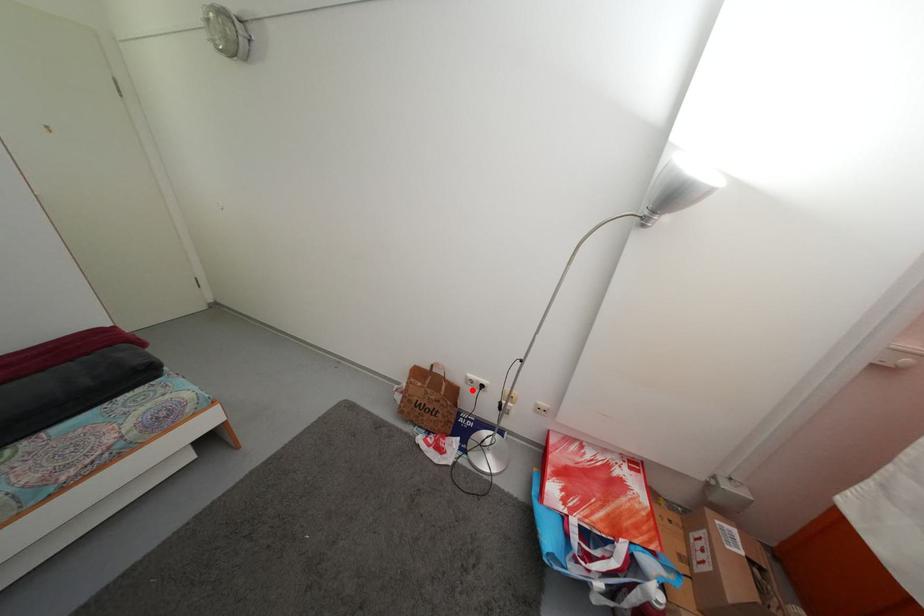
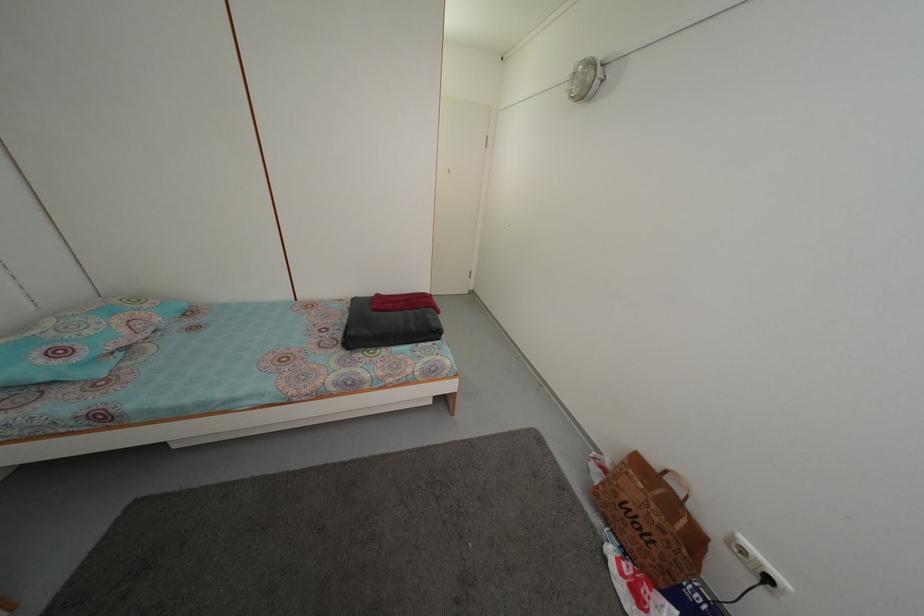
Where in the second image is the point corresponding to the highlighted location from the first image?

(733, 551)